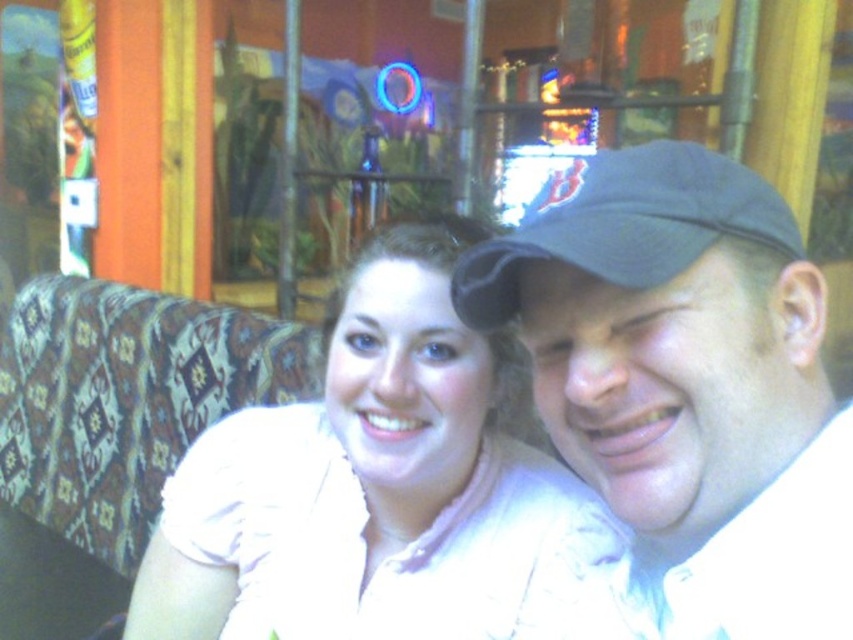
Question: Based on their relative distances, which object is nearer to the dark blue fabric baseball cap at upper right?

Choices:
 (A) black fabric cap at upper right
 (B) white matte shirt at center

Answer: (A)

Question: Is black fabric cap at upper right smaller than white matte shirt at center?

Choices:
 (A) yes
 (B) no

Answer: (A)

Question: Does black fabric cap at upper right appear on the right side of white matte shirt at center?

Choices:
 (A) no
 (B) yes

Answer: (B)

Question: Can you confirm if black fabric cap at upper right is smaller than white matte shirt at center?

Choices:
 (A) yes
 (B) no

Answer: (A)

Question: Which object is closer to the camera taking this photo?

Choices:
 (A) black fabric cap at upper right
 (B) dark blue fabric baseball cap at upper right
 (C) white matte shirt at center

Answer: (A)

Question: Which object is positioned farthest from the white matte shirt at center?

Choices:
 (A) black fabric cap at upper right
 (B) dark blue fabric baseball cap at upper right

Answer: (B)